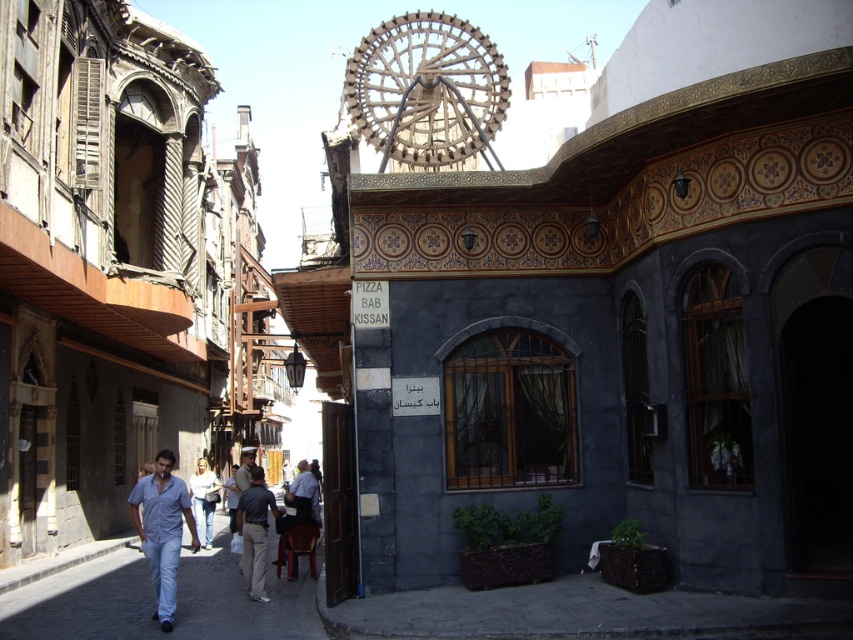
You are a photographer standing on the street and want to take a photo of the wooden at upper center without the light blue jeans at lower left blocking the view. What should you do?

Move your position so that the light blue jeans at lower left is no longer in front of the wooden at upper center. Since the light blue jeans at lower left is currently in front of the wooden at upper center, adjusting your angle or moving to a different spot will allow you to capture the wooden at upper center without obstruction.

You are a photographer standing in the historic street scene. You want to take a photo that includes both the light blue jeans at lower left and the wooden at upper center. Which object should you focus on first to ensure both are in frame?

You should focus on the light blue jeans at lower left first because it is larger than the wooden at upper center, so it will require more space in the frame.

You are a delivery person standing on the street and see the wooden at upper center and dark gray pants at center. Which object is located above the other?

The wooden at upper center is positioned over dark gray pants at center.